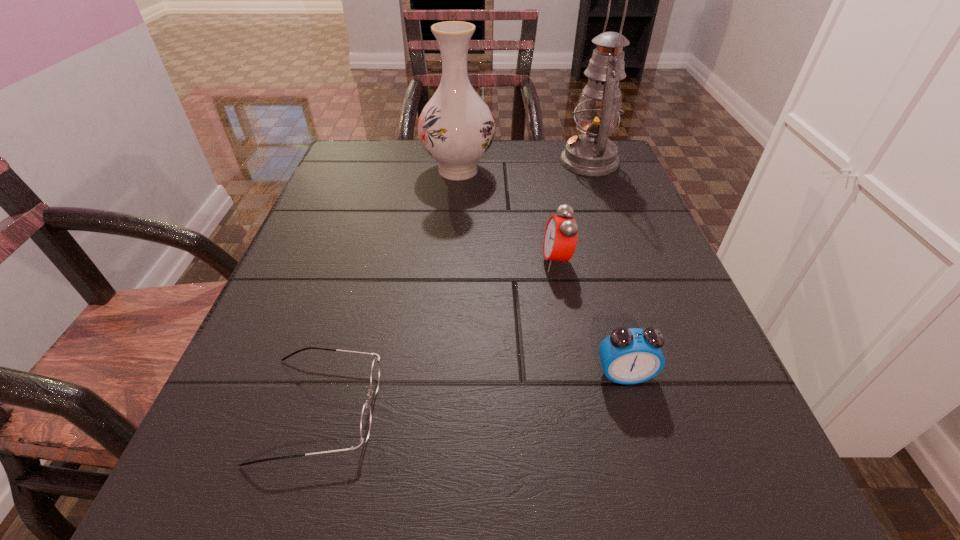
The image size is (960, 540). Identify the location of vacant space that's between the vase and the farther alarm clock. (508, 216).

Where is `blank region between the shorter alarm clock and the shortest object`? blank region between the shorter alarm clock and the shortest object is located at coordinates (472, 392).

The height and width of the screenshot is (540, 960). I want to click on free space between the second shortest object and the third nearest object, so click(590, 318).

This screenshot has width=960, height=540. What are the coordinates of `vacant area between the third nearest object and the vase` in the screenshot? It's located at (508, 216).

The width and height of the screenshot is (960, 540). I want to click on free space between the nearer alarm clock and the tallest object, so click(607, 268).

Where is `vacant area that lies between the vase and the spectacles`? vacant area that lies between the vase and the spectacles is located at coordinates (389, 289).

Identify which object is the nearest to the third nearest object. Please provide its 2D coordinates. Your answer should be formatted as a tuple, i.e. [(x, y)], where the tuple contains the x and y coordinates of a point satisfying the conditions above.

[(628, 356)]

Point out which object is positioned as the fourth nearest to the second shortest object. Please provide its 2D coordinates. Your answer should be formatted as a tuple, i.e. [(x, y)], where the tuple contains the x and y coordinates of a point satisfying the conditions above.

[(592, 153)]

Locate an element on the screen. This screenshot has height=540, width=960. free location that satisfies the following two spatial constraints: 1. on the face of the second shortest object; 2. through the lenses of the spectacles is located at coordinates (634, 409).

Where is `vacant space that satisfies the following two spatial constraints: 1. on the back side of the second tallest object; 2. on the right side of the oil lamp`? The image size is (960, 540). vacant space that satisfies the following two spatial constraints: 1. on the back side of the second tallest object; 2. on the right side of the oil lamp is located at coordinates (459, 162).